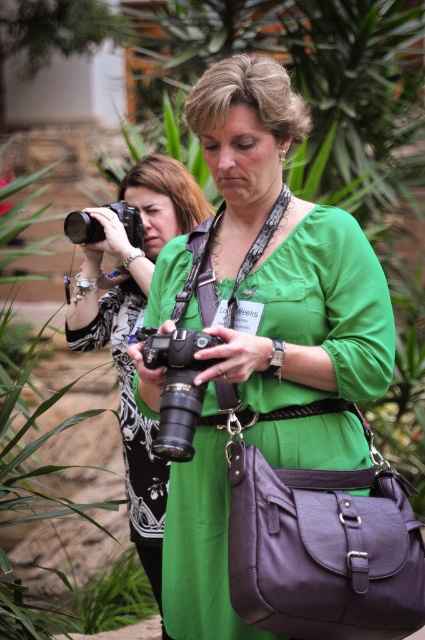
How distant is matte black camera at center from black plastic camera at upper left?

19.02 inches

In the scene shown: Can you confirm if matte black camera at center is positioned to the left of black plastic camera at upper left?

In fact, matte black camera at center is to the right of black plastic camera at upper left.

The width and height of the screenshot is (425, 640). I want to click on matte black camera at center, so click(x=133, y=326).

Where is `purple leather bag at lower center`? This screenshot has height=640, width=425. purple leather bag at lower center is located at coordinates (323, 545).

Identify the location of purple leather bag at lower center. The width and height of the screenshot is (425, 640). (323, 545).

Which is in front, point (308, 522) or point (169, 451)?

Positioned in front is point (169, 451).

Can you confirm if purple leather bag at lower center is smaller than black plastic camera at center?

Actually, purple leather bag at lower center might be larger than black plastic camera at center.

This screenshot has height=640, width=425. Identify the location of purple leather bag at lower center. (323, 545).